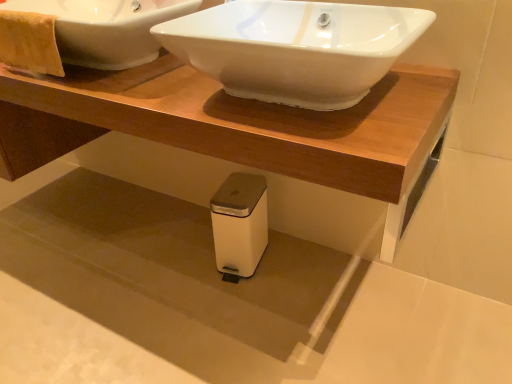
What are the coordinates of `free spot in front of white matte trash can at lower center` in the screenshot? It's located at (246, 309).